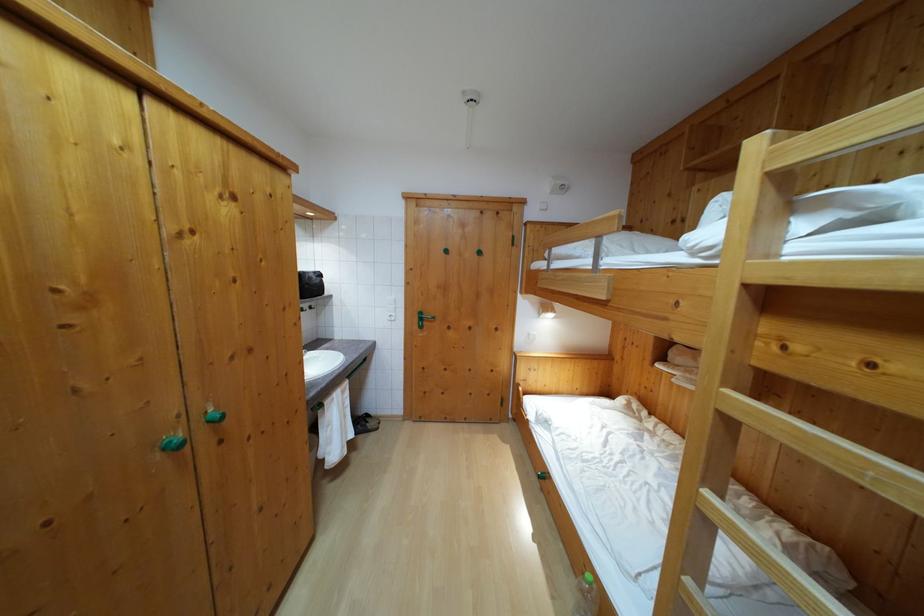
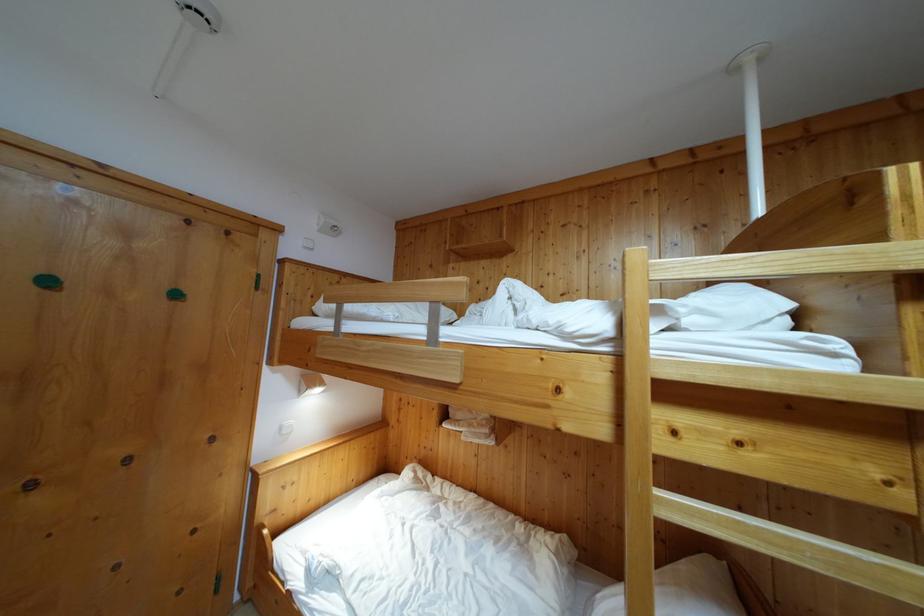
Question: The first image is from the beginning of the video and the second image is from the end. How did the camera likely rotate when shooting the video?

Choices:
 (A) Left
 (B) Right
 (C) Up
 (D) Down

Answer: (B)